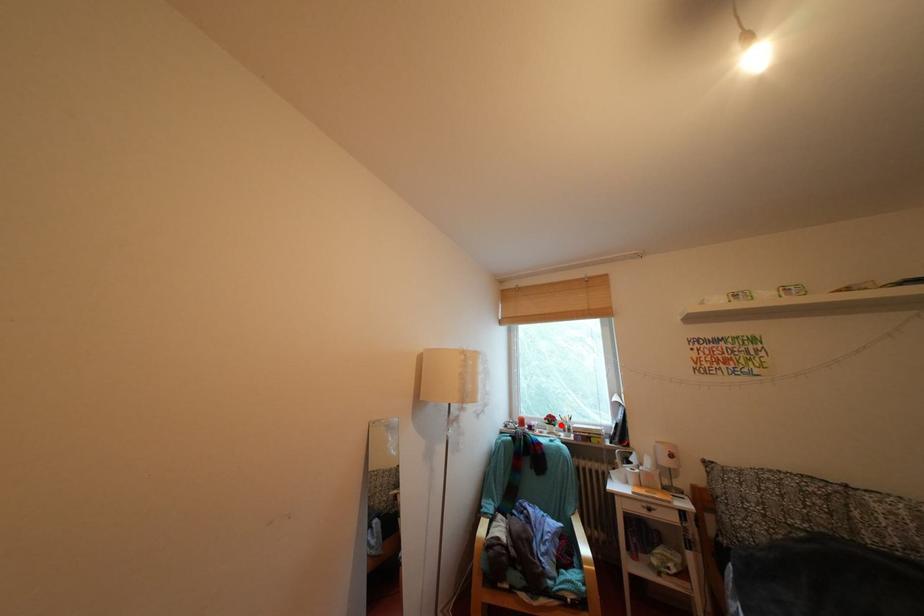
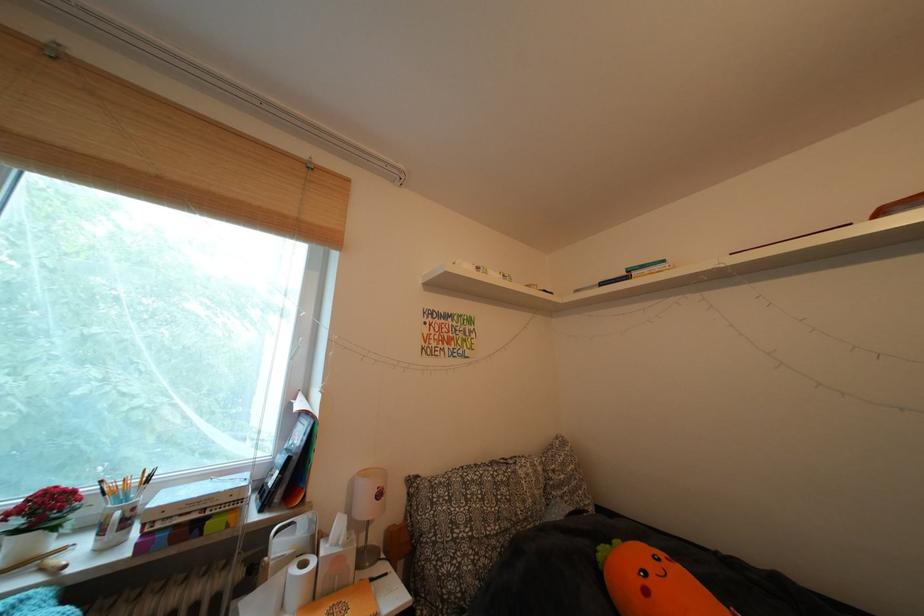
In the second image, find the point that corresponds to the highlighted location in the first image.

(56, 513)